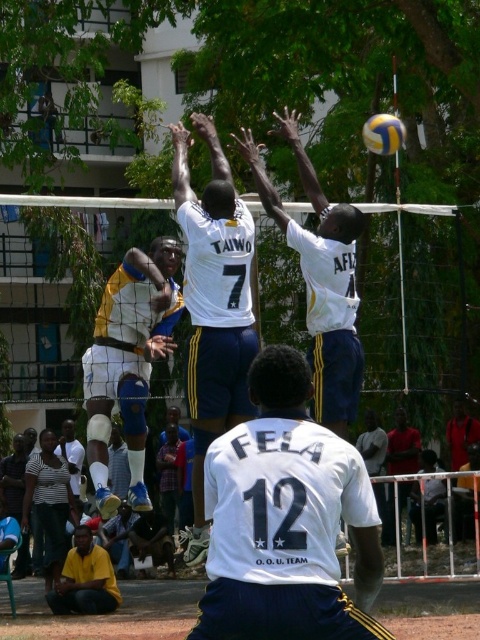
Question: Observing the image, what is the correct spatial positioning of white matte jersey at center in reference to yellow matte volleyball at upper center?

Choices:
 (A) above
 (B) below

Answer: (B)

Question: Among these points, which one is nearest to the camera?

Choices:
 (A) (210, 449)
 (B) (395, 134)
 (C) (107, 561)
 (D) (192, 209)

Answer: (A)

Question: Which point is closer to the camera?

Choices:
 (A) white jersey at center
 (B) yellow matte volleyball at upper center

Answer: (A)

Question: Is white jersey at center to the right of white matte jersey at center from the viewer's perspective?

Choices:
 (A) yes
 (B) no

Answer: (A)

Question: Can you confirm if white jersey at center is positioned to the left of white matte jersey at center?

Choices:
 (A) no
 (B) yes

Answer: (A)

Question: Estimate the real-world distances between objects in this image. Which object is closer to the yellow shirt at lower left?

Choices:
 (A) dark red shirt at lower right
 (B) yellow and blue uniform at center
 (C) yellow matte volleyball at upper center
 (D) white matte jersey at center

Answer: (B)